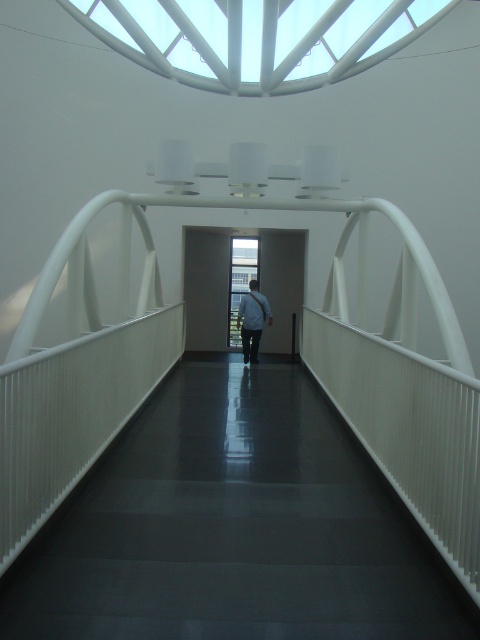
Does black glossy path at center have a greater width compared to white fabric bag at center?

Indeed, black glossy path at center has a greater width compared to white fabric bag at center.

This screenshot has width=480, height=640. Identify the location of black glossy path at center. (233, 525).

What are the coordinates of `black glossy path at center` in the screenshot? It's located at (233, 525).